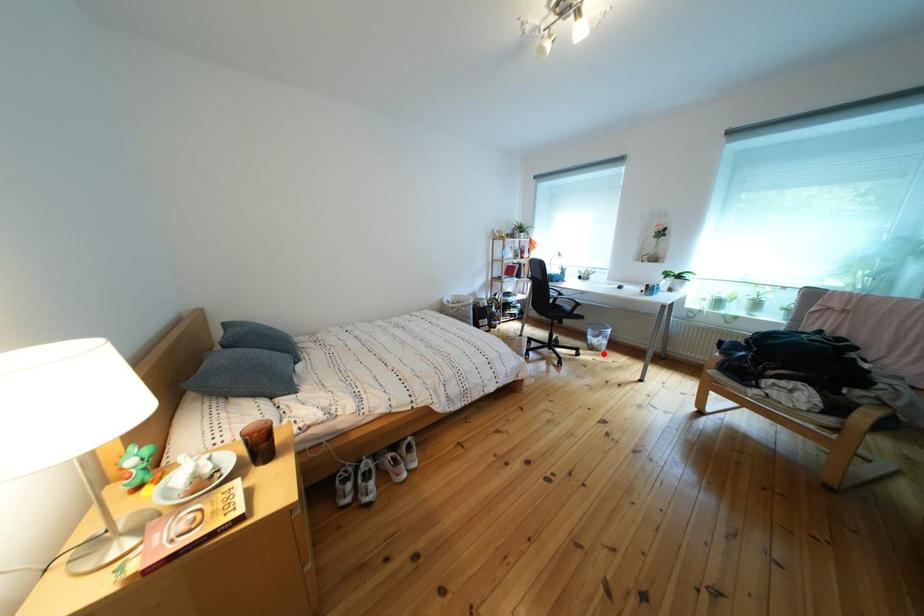
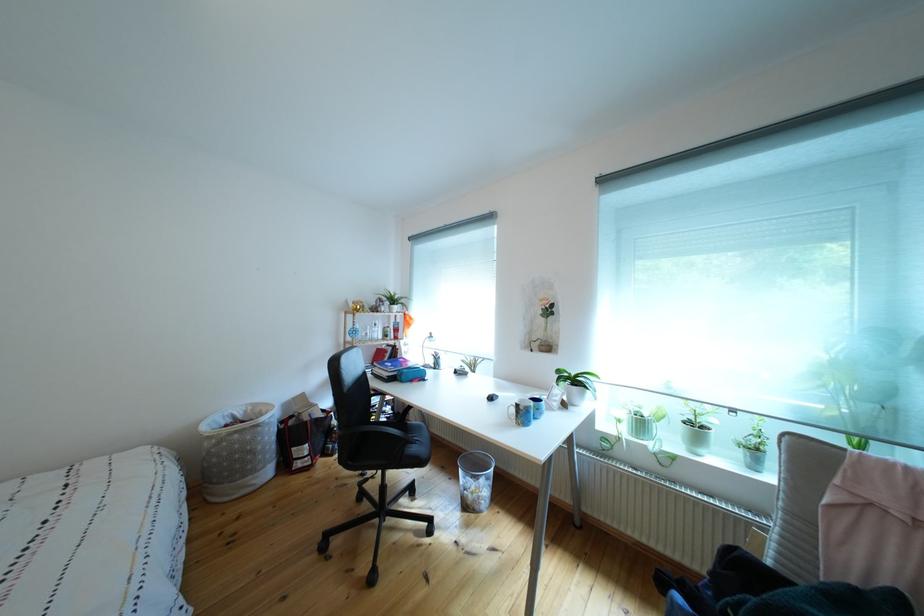
Question: A red point is marked in image1. In image2, is the corresponding 3D point closer to the camera or farther? Reply with the corresponding letter.

Choices:
 (A) The corresponding 3D point is closer.
 (B) The corresponding 3D point is farther.

Answer: (B)